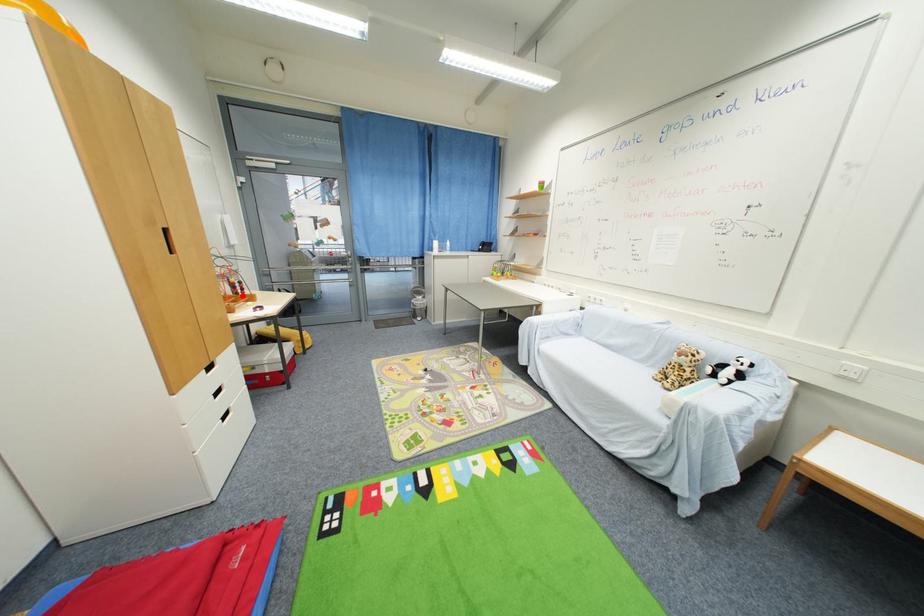
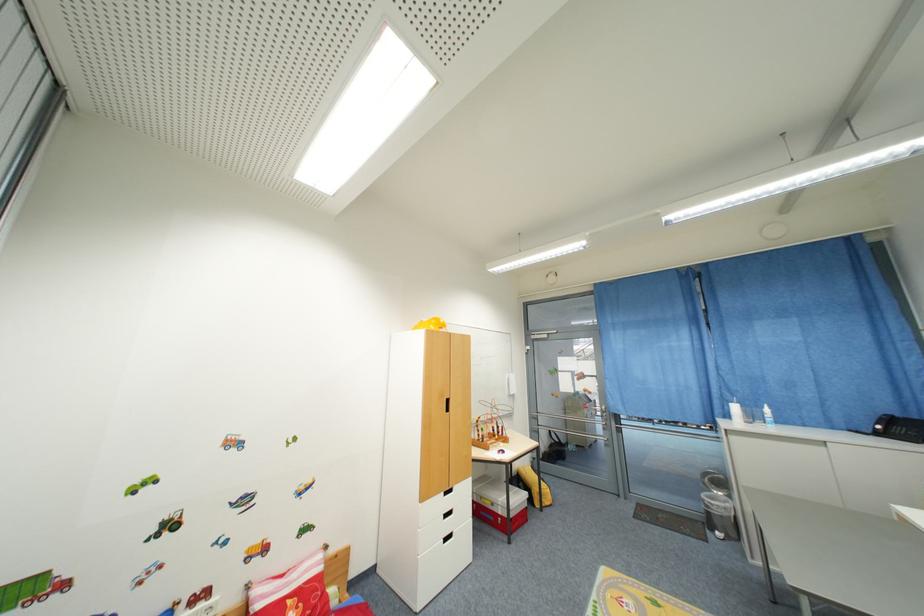
Where in the second image is the point corresponding to the highlighted location from the first image?

(500, 438)